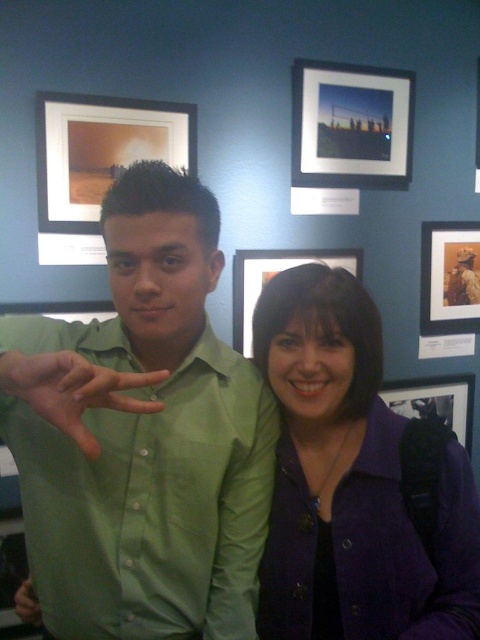
You are standing in an art gallery and want to take a closer look at the framed photograph located at point (41,433). If your arm is 70 centimeters long, can you reach the photograph without moving your feet?

The distance between you and the framed photograph at point (41,433) is 91.77 centimeters. Since your arm is 70 centimeters long, you cannot reach it without moving closer.

Based on the photo, you are a photographer trying to capture a closeup of the green smooth shirt at center without including the matte glass picture frame at upper center in the shot. Based on their positions, can you do this?

The green smooth shirt at center might be wider than matte glass picture frame at upper center, so there is a possibility that the photographer can adjust the camera angle or zoom to focus solely on the green smooth shirt at center while excluding the matte glass picture frame at upper center from the frame.